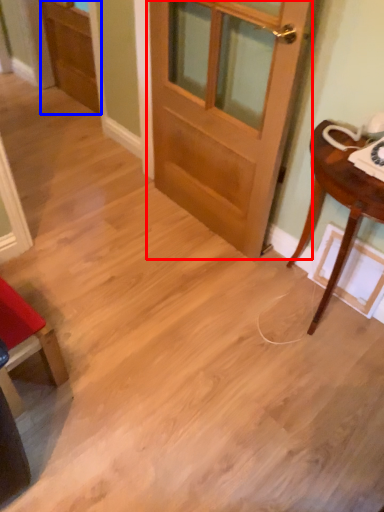
Question: Which point is closer to the camera, door (highlighted by a red box) or screen door (highlighted by a blue box)?

Choices:
 (A) door
 (B) screen door

Answer: (A)